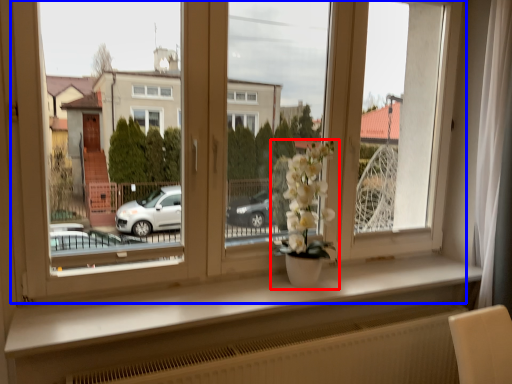
Question: Among these objects, which one is nearest to the camera, houseplant (highlighted by a red box) or window (highlighted by a blue box)?

Choices:
 (A) houseplant
 (B) window

Answer: (B)